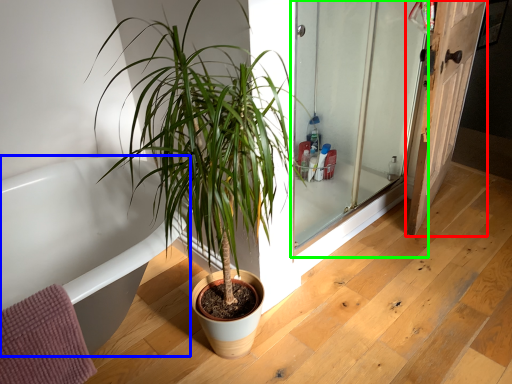
Question: Which object is the farthest from door (highlighted by a red box)? Choose among these: bathtub (highlighted by a blue box) or screen door (highlighted by a green box).

Choices:
 (A) bathtub
 (B) screen door

Answer: (A)